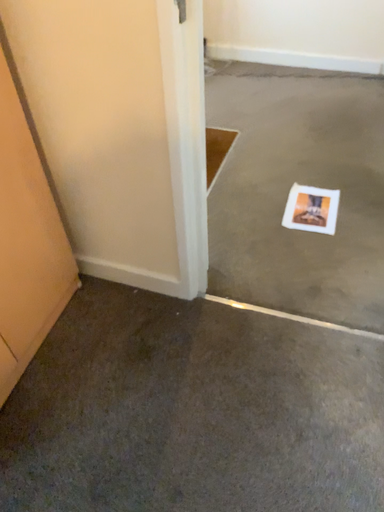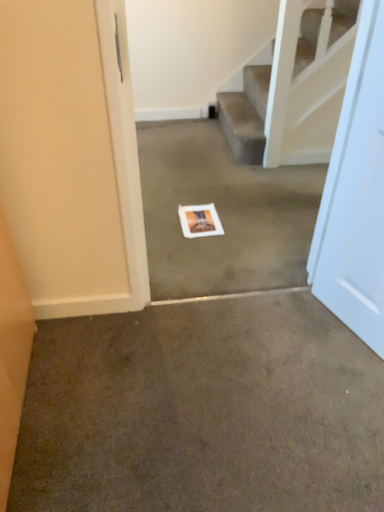
Question: How did the camera likely rotate when shooting the video?

Choices:
 (A) rotated right
 (B) rotated left

Answer: (A)